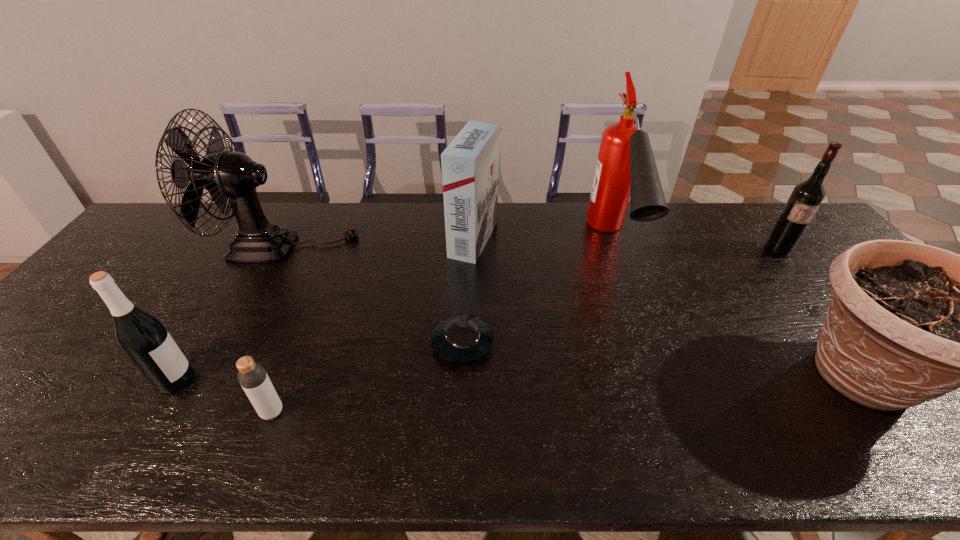
Image resolution: width=960 pixels, height=540 pixels. In order to click on fire extinguisher in this screenshot , I will do `click(626, 171)`.

This screenshot has width=960, height=540. Identify the location of fan. (230, 177).

The width and height of the screenshot is (960, 540). In order to click on the right wine bottle in this screenshot , I will do `click(805, 199)`.

You are a GUI agent. You are given a task and a screenshot of the screen. Output one action in this format:
    pyautogui.click(x=<x>, y=<y>)
    Task: Click on the cigarette case
    The image size is (960, 540).
    Given the screenshot: What is the action you would take?
    pyautogui.click(x=470, y=164)

Identify the location of the left wine bottle. The width and height of the screenshot is (960, 540). (143, 338).

Locate an element on the screen. The height and width of the screenshot is (540, 960). bottle is located at coordinates (252, 376).

I want to click on saucer, so click(x=462, y=338).

Where is `vacant area located at the nozzle of the sixth object from left to right`? The height and width of the screenshot is (540, 960). vacant area located at the nozzle of the sixth object from left to right is located at coordinates pyautogui.click(x=663, y=386).

Find the location of a particular element. free spot located in front of the fan, indicating the direction of air flow is located at coordinates (372, 247).

The height and width of the screenshot is (540, 960). I want to click on vacant space situated on the front and back of the right wine bottle, so click(x=821, y=305).